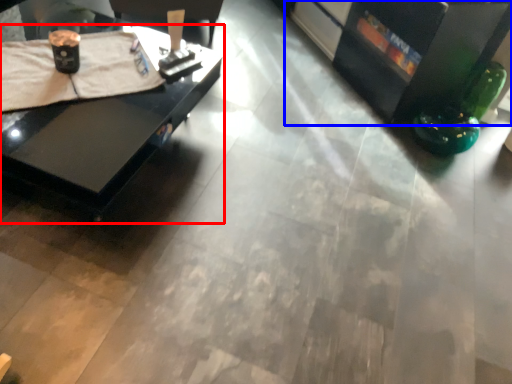
Question: Which object appears farthest to the camera in this image, table (highlighted by a red box) or entertainment center (highlighted by a blue box)?

Choices:
 (A) table
 (B) entertainment center

Answer: (B)